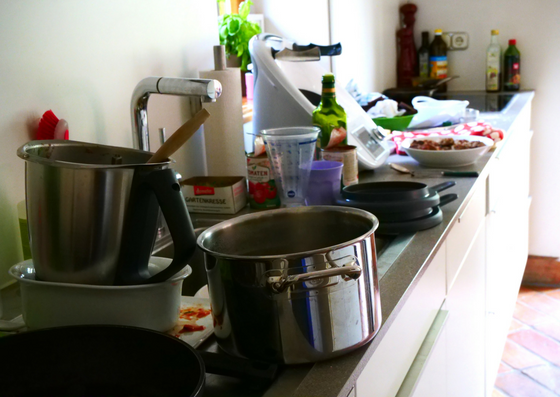
Where is `napkin`? napkin is located at coordinates (234, 119).